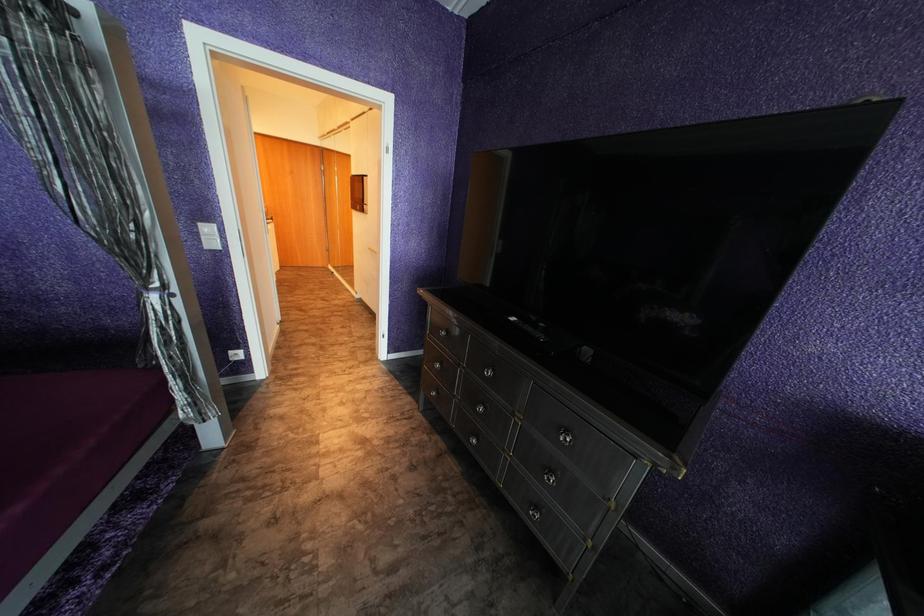
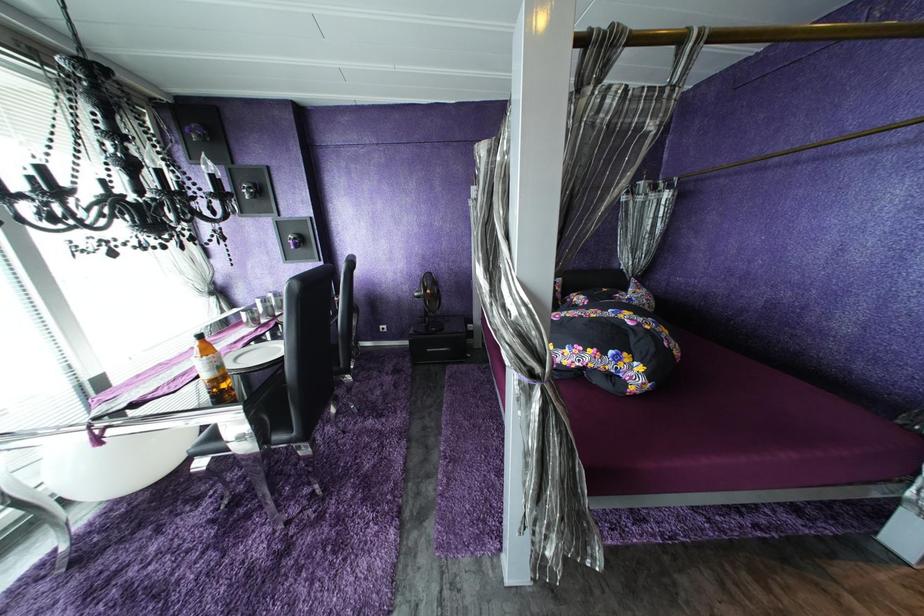
How did the camera likely rotate?

The camera rotated toward left-down.